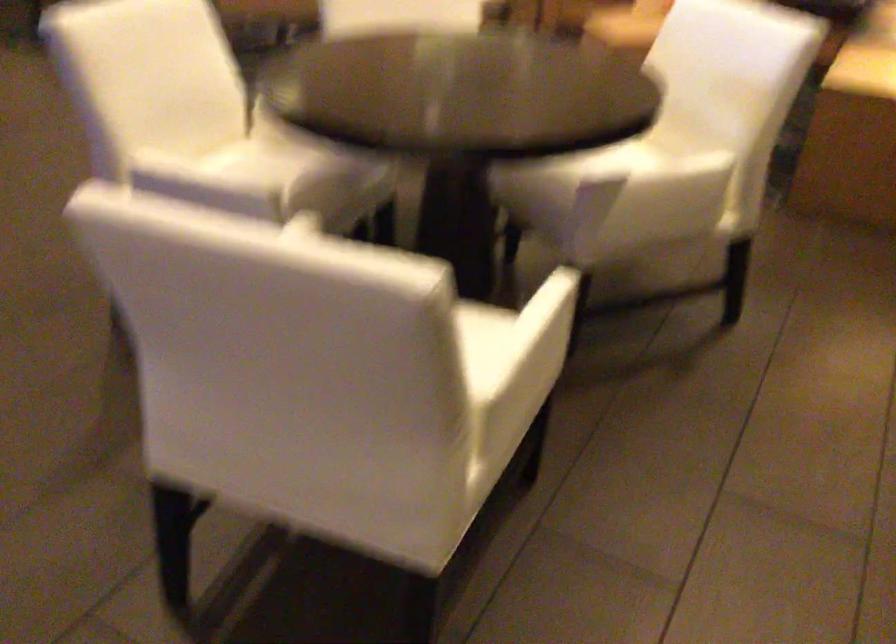
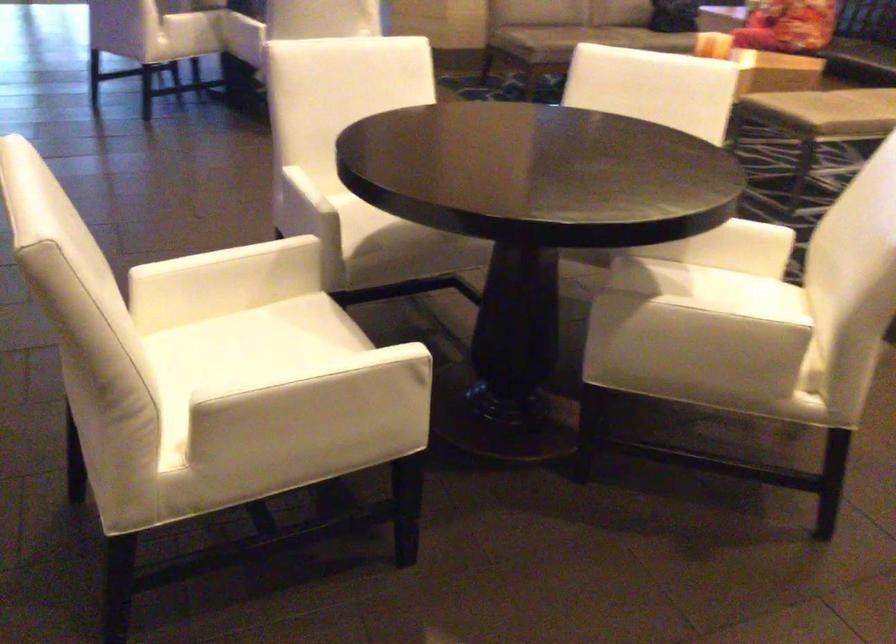
Find the pixel in the second image that matches point 593,156 in the first image.

(711, 290)